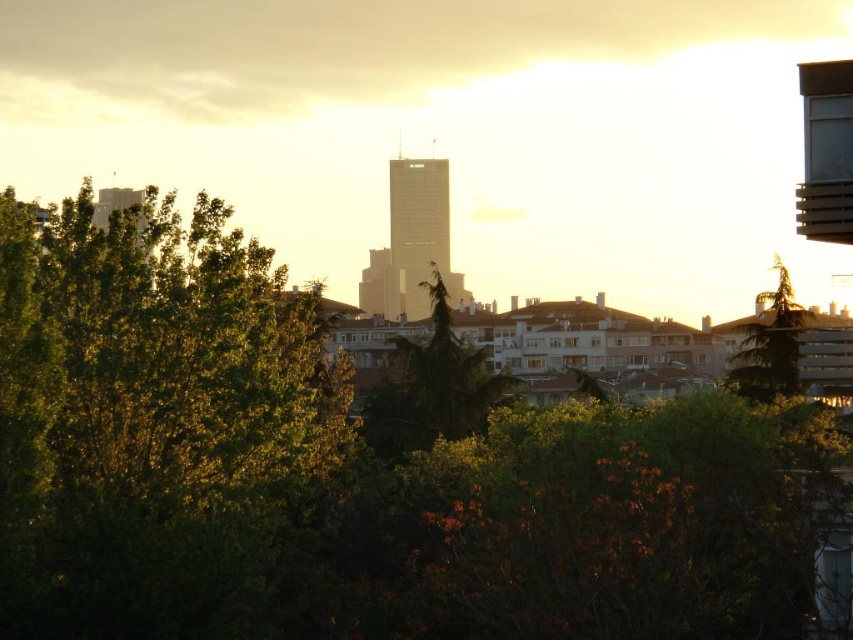
Question: Can you confirm if green leafy tree at center is positioned to the right of green textured tree at center?

Choices:
 (A) yes
 (B) no

Answer: (A)

Question: Which point is farther to the camera?

Choices:
 (A) [100, 413]
 (B) [410, 385]
 (C) [764, 372]

Answer: (C)

Question: Is green leafy tree at center above green textured tree at center?

Choices:
 (A) no
 (B) yes

Answer: (A)

Question: Can you confirm if green textured tree at center is positioned to the right of green textured tree at right?

Choices:
 (A) yes
 (B) no

Answer: (B)

Question: Which of these objects is positioned farthest from the green leafy tree at center?

Choices:
 (A) green textured tree at right
 (B) green leafy tree at left

Answer: (A)

Question: Which point appears closest to the camera in this image?

Choices:
 (A) (315, 317)
 (B) (762, 296)
 (C) (224, 481)
 (D) (440, 362)

Answer: (C)